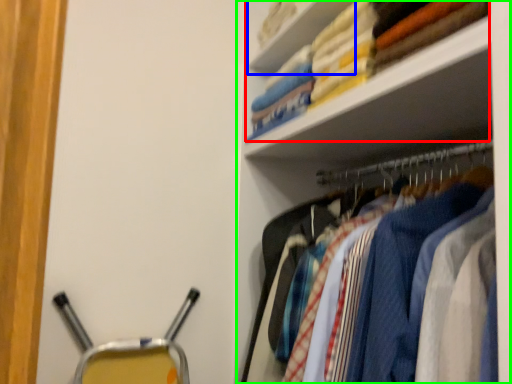
Question: Estimate the real-world distances between objects in this image. Which object is closer to laundry (highlighted by a red box), cabinet (highlighted by a blue box) or shelf (highlighted by a green box)?

Choices:
 (A) cabinet
 (B) shelf

Answer: (A)